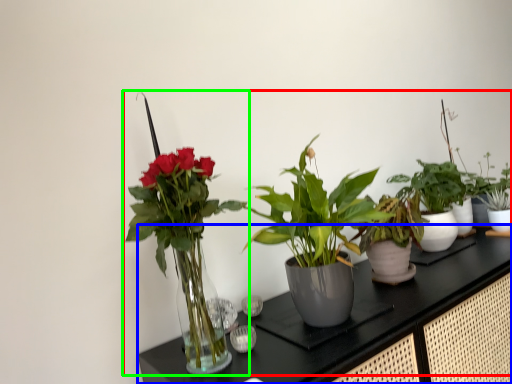
Question: Considering the real-world distances, which object is farthest from houseplant (highlighted by a red box)? counter (highlighted by a blue box) or houseplant (highlighted by a green box)?

Choices:
 (A) counter
 (B) houseplant

Answer: (B)